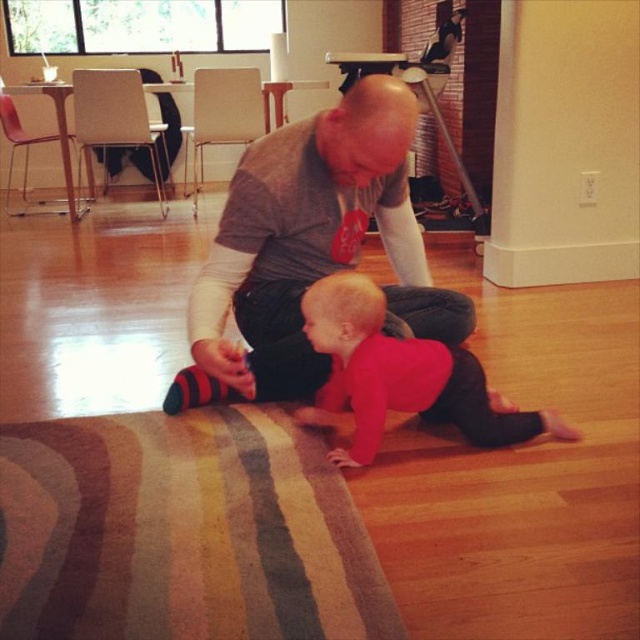
You are a photographer setting up a shoot in this living room. You need to position a camera so that both the gray cotton shirt at center and the matte red shirt at center are visible in the frame. Based on their positions, which shirt should you focus on first to ensure both are in focus?

The gray cotton shirt at center is in front of the matte red shirt at center, so focusing on the gray cotton shirt at center first will ensure both are in focus as the matte red shirt at center is behind it.

You are a fashion designer observing two shirts in the image. The gray cotton shirt at center and the matte red shirt at center. Which one is positioned higher on the person?

The gray cotton shirt at center is positioned higher because it is above the matte red shirt at center.